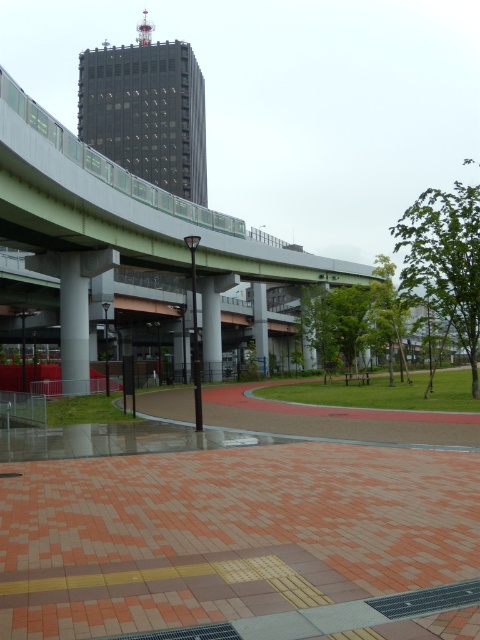
Can you confirm if green concrete overpass at upper center is shorter than satin silver pole at center?

Indeed, green concrete overpass at upper center has a lesser height compared to satin silver pole at center.

Does green concrete overpass at upper center appear on the left side of satin silver pole at center?

Yes, green concrete overpass at upper center is to the left of satin silver pole at center.

The width and height of the screenshot is (480, 640). What do you see at coordinates (129, 209) in the screenshot? I see `green concrete overpass at upper center` at bounding box center [129, 209].

Locate an element on the screen. This screenshot has height=640, width=480. green concrete overpass at upper center is located at coordinates (129, 209).

Does red rubber path at center have a lesser width compared to satin silver pole at center?

In fact, red rubber path at center might be wider than satin silver pole at center.

Is point (321, 413) positioned behind point (262, 314)?

No, (321, 413) is closer to viewer.

I want to click on red rubber path at center, so click(335, 419).

Does green concrete overpass at upper center have a lesser height compared to white concrete pillar at center?

Correct, green concrete overpass at upper center is not as tall as white concrete pillar at center.

Describe the element at coordinates (129, 209) in the screenshot. I see `green concrete overpass at upper center` at that location.

Identify the location of green concrete overpass at upper center. This screenshot has width=480, height=640. (129, 209).